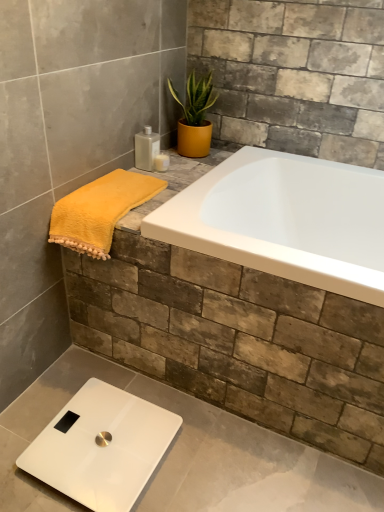
I want to click on vacant space in front of translucent plastic soap dispenser at upper center, which is the 2th toiletry in left-to-right order, so click(x=170, y=185).